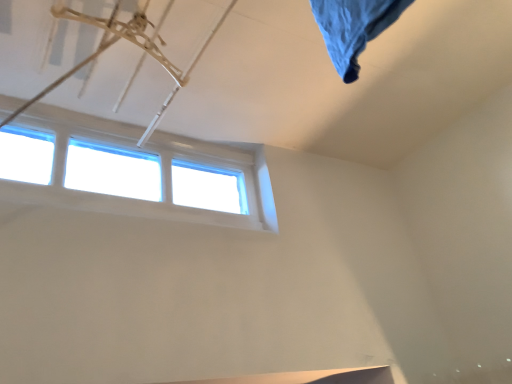
I want to click on transparent glass window at upper center, so click(x=132, y=172).

This screenshot has width=512, height=384. What do you see at coordinates (132, 172) in the screenshot?
I see `transparent glass window at upper center` at bounding box center [132, 172].

Identify the location of transparent glass window at upper center. (132, 172).